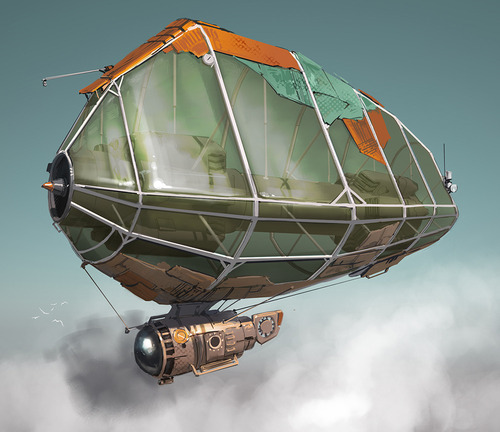
Where is `metal bulb`? This screenshot has height=432, width=500. metal bulb is located at coordinates (151, 355).